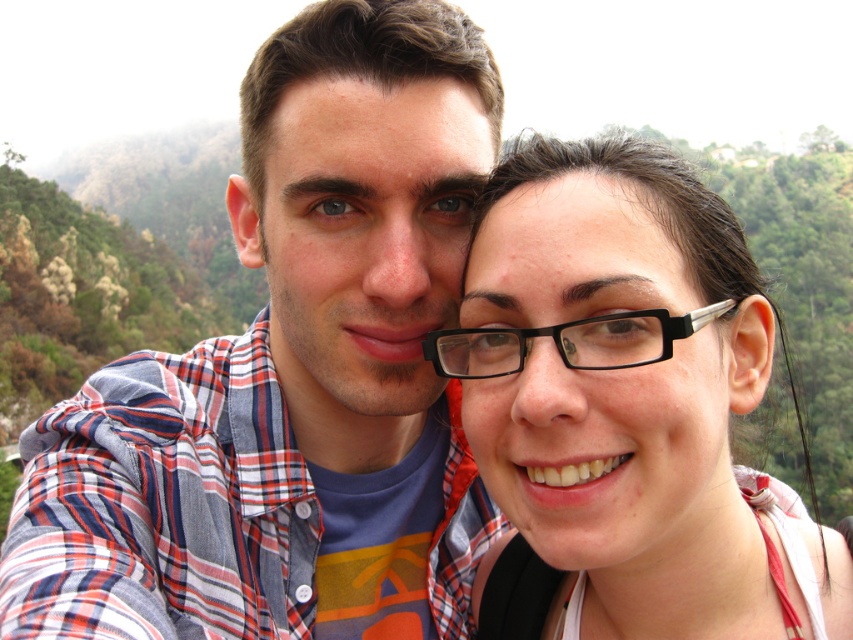
Is plaid shirt at center further to camera compared to black plastic glasses at center?

No, plaid shirt at center is in front of black plastic glasses at center.

Can you confirm if plaid shirt at center is bigger than black plastic glasses at center?

Yes.

Find the location of a particular element. The width and height of the screenshot is (853, 640). plaid shirt at center is located at coordinates (291, 374).

I want to click on plaid shirt at center, so click(291, 374).

Is plaid shirt at center positioned behind clear plastic glasses at upper right?

That is False.

The width and height of the screenshot is (853, 640). Find the location of `plaid shirt at center`. plaid shirt at center is located at coordinates (291, 374).

Between clear plastic glasses at upper right and black plastic glasses at center, which one appears on the left side from the viewer's perspective?

black plastic glasses at center

Consider the image. Can you confirm if clear plastic glasses at upper right is bigger than black plastic glasses at center?

Yes, clear plastic glasses at upper right is bigger than black plastic glasses at center.

Between point (593, 148) and point (666, 333), which one is positioned in front?

Point (666, 333) is in front.

I want to click on clear plastic glasses at upper right, so click(x=625, y=406).